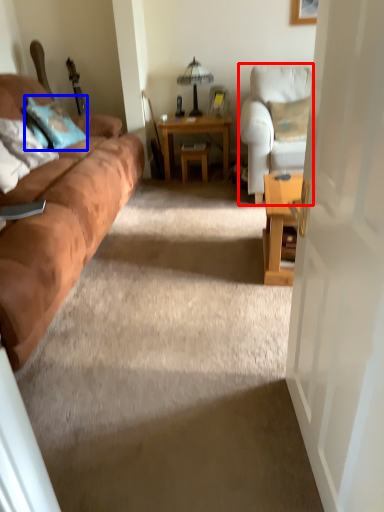
Question: Which object is further to the camera taking this photo, chair (highlighted by a red box) or pillow (highlighted by a blue box)?

Choices:
 (A) chair
 (B) pillow

Answer: (B)